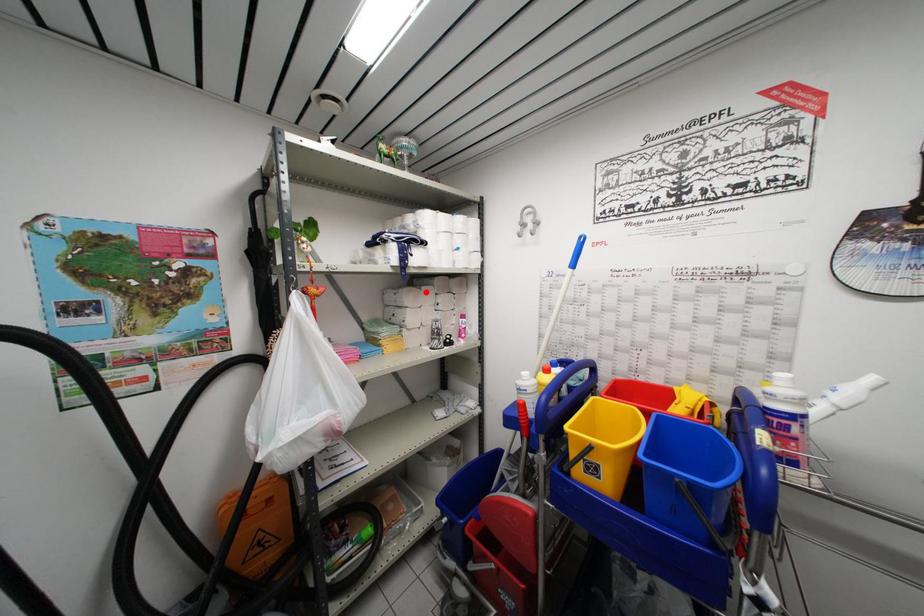
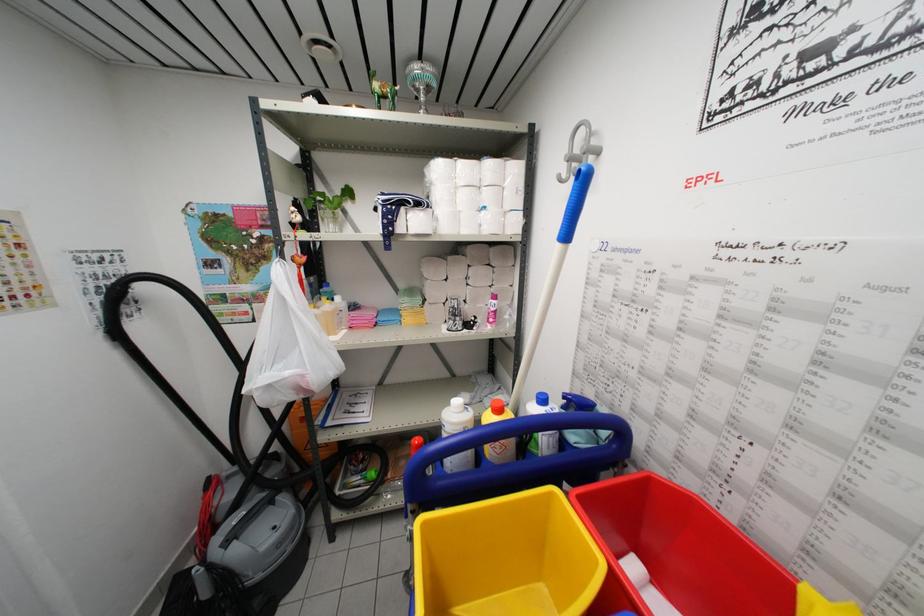
The point at the highlighted location is marked in the first image. Where is the corresponding point in the second image?

(453, 262)